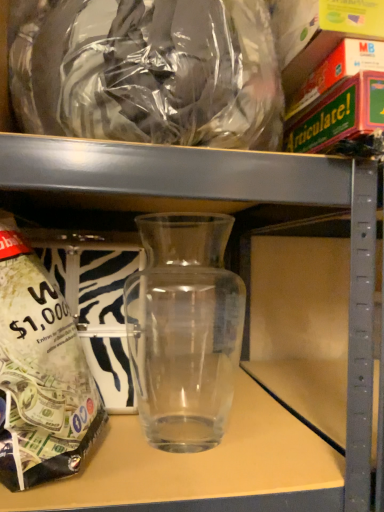
This screenshot has width=384, height=512. Describe the element at coordinates (148, 71) in the screenshot. I see `transparent plastic bag at upper center` at that location.

This screenshot has width=384, height=512. I want to click on transparent plastic bag at upper center, so click(x=148, y=71).

This screenshot has width=384, height=512. In order to click on transparent glass jar at left in this screenshot , I will do `click(41, 373)`.

Can you confirm if transparent plastic bag at upper center is taller than transparent glass vase at center?

Yes, transparent plastic bag at upper center is taller than transparent glass vase at center.

From a real-world perspective, which object stands above the other?

transparent plastic bag at upper center, from a real-world perspective.

Considering the relative sizes of transparent plastic bag at upper center and transparent glass vase at center in the image provided, is transparent plastic bag at upper center bigger than transparent glass vase at center?

Indeed, transparent plastic bag at upper center has a larger size compared to transparent glass vase at center.

Is transparent glass vase at center oriented towards transparent plastic bag at upper center?

No, transparent glass vase at center does not turn towards transparent plastic bag at upper center.

Does transparent glass vase at center have a greater height compared to transparent plastic bag at upper center?

In fact, transparent glass vase at center may be shorter than transparent plastic bag at upper center.

Is transparent glass vase at center far from transparent plastic bag at upper center?

No.

Is transparent glass jar at left closer to camera compared to transparent glass vase at center?

Yes.

Considering the sizes of objects transparent glass jar at left and transparent glass vase at center in the image provided, who is taller, transparent glass jar at left or transparent glass vase at center?

Standing taller between the two is transparent glass jar at left.

Is transparent glass jar at left not within transparent glass vase at center?

transparent glass jar at left is positioned outside transparent glass vase at center.

What's the angular difference between transparent glass jar at left and transparent plastic bag at upper center's facing directions?

0.927 degrees.

Considering the sizes of transparent glass jar at left and transparent plastic bag at upper center in the image, is transparent glass jar at left wider or thinner than transparent plastic bag at upper center?

In the image, transparent glass jar at left appears to be wider than transparent plastic bag at upper center.

Is transparent glass jar at left taller or shorter than transparent plastic bag at upper center?

Considering their sizes, transparent glass jar at left has less height than transparent plastic bag at upper center.

Is transparent glass jar at left inside the boundaries of transparent plastic bag at upper center, or outside?

transparent glass jar at left is spatially situated outside transparent plastic bag at upper center.

Is transparent glass vase at center facing away from transparent glass jar at left?

No, transparent glass vase at center is not facing away from transparent glass jar at left.

In the image, is transparent glass vase at center positioned in front of or behind transparent glass jar at left?

transparent glass vase at center is positioned farther from the viewer than transparent glass jar at left.

Would you consider transparent glass vase at center to be distant from transparent glass jar at left?

They are positioned close to each other.

Based on their sizes in the image, would you say transparent glass vase at center is bigger or smaller than transparent glass jar at left?

Clearly, transparent glass vase at center is smaller in size than transparent glass jar at left.

You are a GUI agent. You are given a task and a screenshot of the screen. Output one action in this format:
    pyautogui.click(x=<x>, y=<y>)
    Task: Click on the plastic bag that is above the transparent glass jar at left (from the image's perspective)
    The width and height of the screenshot is (384, 512).
    Given the screenshot: What is the action you would take?
    pyautogui.click(x=148, y=71)

From the image's perspective, relative to transparent glass jar at left, is transparent plastic bag at upper center above or below?

Clearly, from the image's perspective, transparent plastic bag at upper center is above transparent glass jar at left.

In the scene shown: Is transparent plastic bag at upper center bigger than transparent glass jar at left?

Incorrect, transparent plastic bag at upper center is not larger than transparent glass jar at left.

In the image, there is a transparent glass vase at center. At what (x,y) coordinates should I click in order to perform the action: click on plastic bag above it (from the image's perspective). Please return your answer as a coordinate pair (x, y). The image size is (384, 512). Looking at the image, I should click on 148,71.

This screenshot has height=512, width=384. Identify the location of plastic bag on the left of transparent glass vase at center. (148, 71).

Estimate the real-world distances between objects in this image. Which object is further from transparent plastic bag at upper center, transparent glass jar at left or transparent glass vase at center?

Based on the image, transparent glass vase at center appears to be further to transparent plastic bag at upper center.

Considering their positions, is transparent plastic bag at upper center positioned further to transparent glass vase at center than transparent glass jar at left?

transparent plastic bag at upper center lies further to transparent glass vase at center than the other object.

From the image, which object appears to be farther from transparent glass jar at left, transparent plastic bag at upper center or transparent glass vase at center?

Based on the image, transparent glass vase at center appears to be further to transparent glass jar at left.

Estimate the real-world distances between objects in this image. Which object is closer to transparent plastic bag at upper center, transparent glass vase at center or transparent glass jar at left?

Among the two, transparent glass jar at left is located nearer to transparent plastic bag at upper center.

Looking at the image, which one is located closer to transparent glass jar at left, transparent glass vase at center or transparent plastic bag at upper center?

Based on the image, transparent plastic bag at upper center appears to be nearer to transparent glass jar at left.

Which object lies further to the anchor point transparent glass vase at center, transparent glass jar at left or transparent plastic bag at upper center?

Among the two, transparent plastic bag at upper center is located further to transparent glass vase at center.

In order to click on vase that lies between transparent plastic bag at upper center and transparent glass jar at left from top to bottom in this screenshot , I will do `click(184, 330)`.